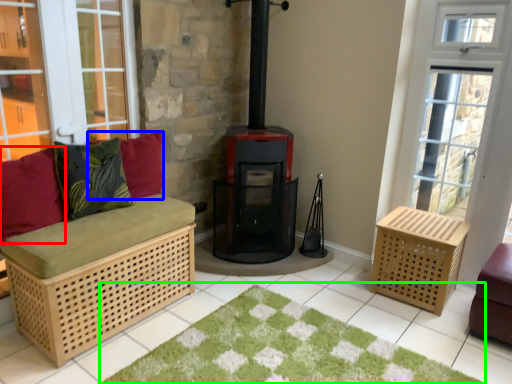
Question: Estimate the real-world distances between objects in this image. Which object is closer to pillow (highlighted by a red box), pillow (highlighted by a blue box) or doormat (highlighted by a green box)?

Choices:
 (A) pillow
 (B) doormat

Answer: (A)